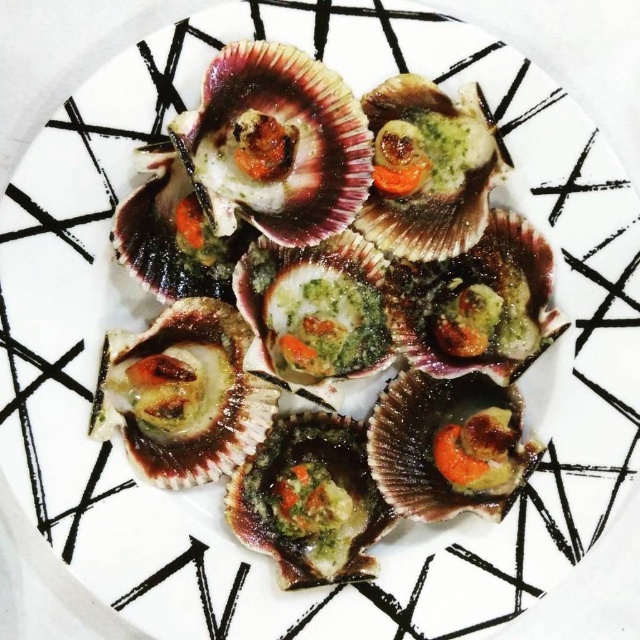
From the picture: You are a food critic evaluating this dish. You notice the green matte scallop at center and the shiny brown shellfish at center. Which one has a greater height?

The green matte scallop at center is taller than the shiny brown shellfish at center.

Looking at this image, you are a chef preparing a dish and need to ensure proper spacing between the green matte scallop at center and the shiny brown shellfish at center. The minimum required distance for food safety is 3 inches. Can you confirm if the current arrangement meets this requirement?

The green matte scallop at center is 4.68 inches from the shiny brown shellfish at center, which exceeds the minimum required distance of 3 inches for food safety. Therefore, the current arrangement meets the requirement.